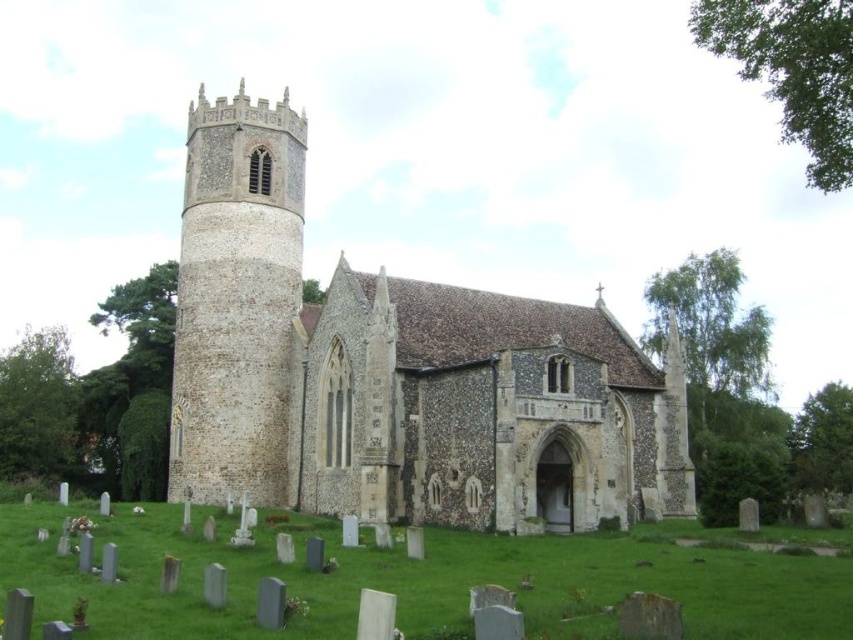
Does stone church at center appear on the left side of stone tower at left?

No, stone church at center is not to the left of stone tower at left.

Is stone church at center thinner than stone tower at left?

No, stone church at center is not thinner than stone tower at left.

Between point (596, 512) and point (192, 440), which one is positioned in front?

Point (596, 512)

This screenshot has width=853, height=640. Identify the location of stone church at center. (395, 371).